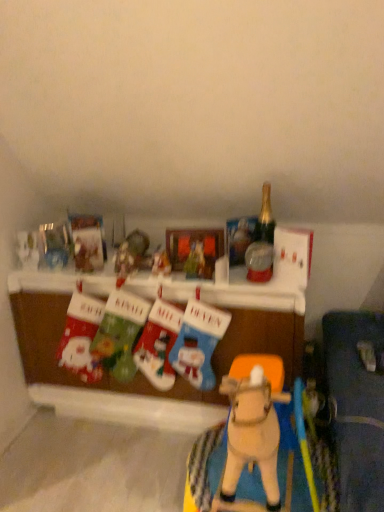
Question: Considering the positions of point (79, 301) and point (256, 493), is point (79, 301) closer or farther from the camera than point (256, 493)?

Choices:
 (A) closer
 (B) farther

Answer: (B)

Question: From the image's perspective, is matte fabric stocking at lower left, the 6th toy from the right, above or below wooden horse at center, the 6th toy from the left?

Choices:
 (A) above
 (B) below

Answer: (A)

Question: Considering the real-world distances, which object is closest to the velvet christmas stockings at center, which appears as the third toy when viewed from the left?

Choices:
 (A) velvet green stocking at center, arranged as the second toy when viewed from the left
 (B) gold glass bottle at upper right
 (C) matte fabric stocking at lower left, the 1th toy when ordered from left to right
 (D) knitted wool stocking at center, which ranks as the fifth toy in left-to-right order
 (E) fabric christmas stockings at center

Answer: (D)

Question: Considering the real-world distances, which object is farthest from the velvet christmas stockings at center, which appears as the third toy when viewed from the left?

Choices:
 (A) matte plastic ornament at center, acting as the third toy starting from the right
 (B) fabric christmas stockings at center
 (C) matte fabric stocking at lower left, the 1th toy when ordered from left to right
 (D) knitted wool stocking at center, marked as the 2th toy in a right-to-left arrangement
 (E) matte plastic picture frame at center

Answer: (E)